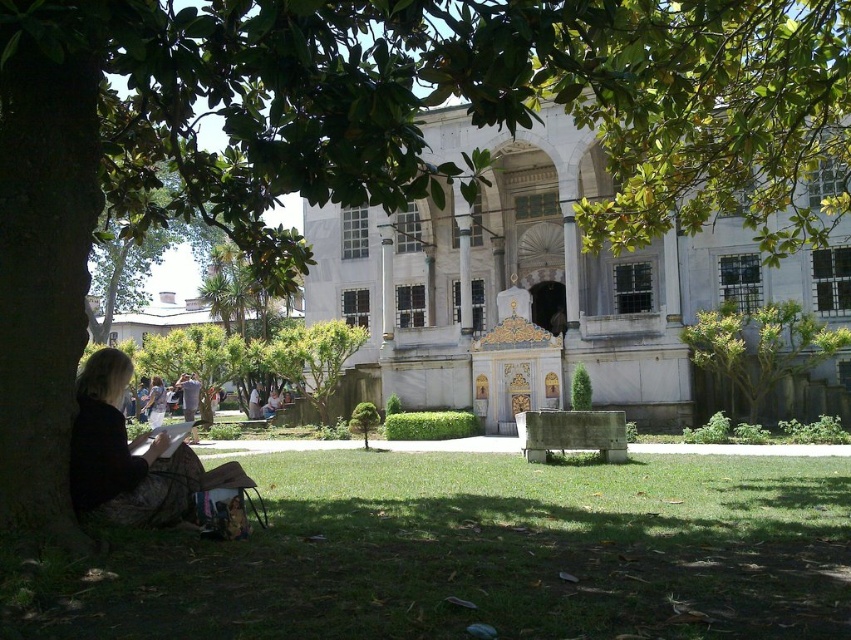
Question: Based on their relative distances, which object is farther from the blonde hair at lower left?

Choices:
 (A) green leafy tree at right
 (B) white marble palace at center

Answer: (B)

Question: Can you confirm if green grass at lower center is smaller than green leafy tree at right?

Choices:
 (A) yes
 (B) no

Answer: (B)

Question: Among these objects, which one is nearest to the camera?

Choices:
 (A) white marble palace at center
 (B) blonde hair at lower left
 (C) green leafy tree at right

Answer: (B)

Question: Which point is closer to the camera?

Choices:
 (A) [x=637, y=540]
 (B) [x=156, y=477]
 (C) [x=152, y=380]

Answer: (B)

Question: Does green grass at lower center appear on the right side of green leafy tree at right?

Choices:
 (A) yes
 (B) no

Answer: (B)

Question: Is white marble palace at center bigger than blonde hair at lower left?

Choices:
 (A) no
 (B) yes

Answer: (B)